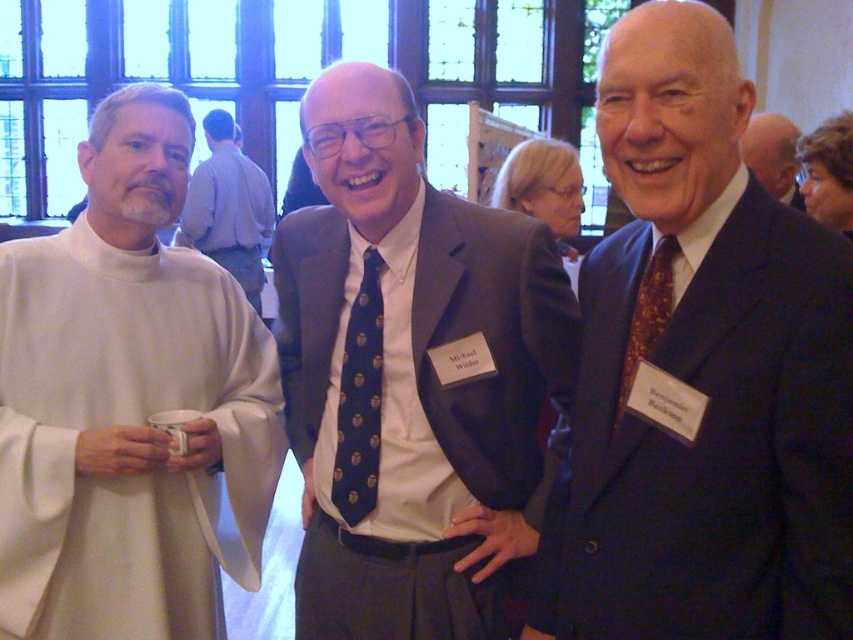
Does point (714, 186) come in front of point (253, 454)?

Yes, it is.

This screenshot has width=853, height=640. I want to click on dark blue suit at center, so click(701, 372).

Which is more to the left, dark blue suit at center or blue dotted tie at center?

From the viewer's perspective, blue dotted tie at center appears more on the left side.

Which of these two, dark blue suit at center or blue dotted tie at center, stands taller?

dark blue suit at center

Find the location of a particular element. This screenshot has height=640, width=853. dark blue suit at center is located at coordinates pyautogui.click(x=701, y=372).

Does brown textured tie at right have a lesser width compared to matte black suit at center?

No.

How much distance is there between brown textured tie at right and matte black suit at center?

The distance of brown textured tie at right from matte black suit at center is 55.91 feet.

The height and width of the screenshot is (640, 853). I want to click on brown textured tie at right, so click(x=648, y=314).

The image size is (853, 640). Find the location of `brown textured tie at right`. brown textured tie at right is located at coordinates (648, 314).